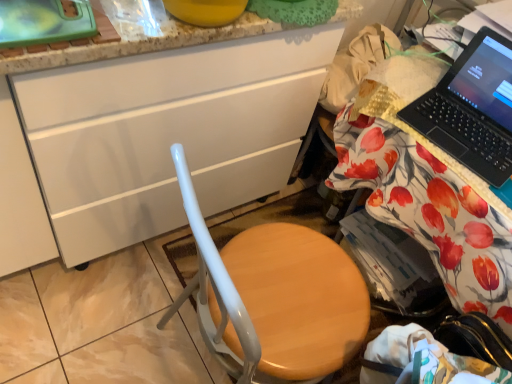
Question: Does wooden seat at center have a greater width compared to white glossy cabinet at center?

Choices:
 (A) yes
 (B) no

Answer: (B)

Question: Is wooden seat at center at the left side of white glossy cabinet at center?

Choices:
 (A) no
 (B) yes

Answer: (A)

Question: Considering the relative positions of wooden seat at center and white glossy cabinet at center in the image provided, is wooden seat at center in front of white glossy cabinet at center?

Choices:
 (A) yes
 (B) no

Answer: (A)

Question: Considering the relative sizes of wooden seat at center and white glossy cabinet at center in the image provided, is wooden seat at center bigger than white glossy cabinet at center?

Choices:
 (A) yes
 (B) no

Answer: (B)

Question: From a real-world perspective, is wooden seat at center below white glossy cabinet at center?

Choices:
 (A) yes
 (B) no

Answer: (A)

Question: Would you say wooden seat at center is a long distance from white glossy cabinet at center?

Choices:
 (A) no
 (B) yes

Answer: (A)

Question: Considering the relative sizes of white glossy cabinet at center and black plastic laptop at upper right in the image provided, is white glossy cabinet at center taller than black plastic laptop at upper right?

Choices:
 (A) no
 (B) yes

Answer: (B)

Question: Does white glossy cabinet at center have a lesser width compared to black plastic laptop at upper right?

Choices:
 (A) yes
 (B) no

Answer: (B)

Question: Considering the relative positions of white glossy cabinet at center and black plastic laptop at upper right in the image provided, is white glossy cabinet at center to the right of black plastic laptop at upper right from the viewer's perspective?

Choices:
 (A) no
 (B) yes

Answer: (A)

Question: From the image's perspective, does white glossy cabinet at center appear lower than black plastic laptop at upper right?

Choices:
 (A) yes
 (B) no

Answer: (B)

Question: Is white glossy cabinet at center positioned far away from black plastic laptop at upper right?

Choices:
 (A) no
 (B) yes

Answer: (A)

Question: Does white glossy cabinet at center lie in front of black plastic laptop at upper right?

Choices:
 (A) no
 (B) yes

Answer: (B)

Question: Does white glossy cabinet at center contain wooden desk at right?

Choices:
 (A) no
 (B) yes

Answer: (A)